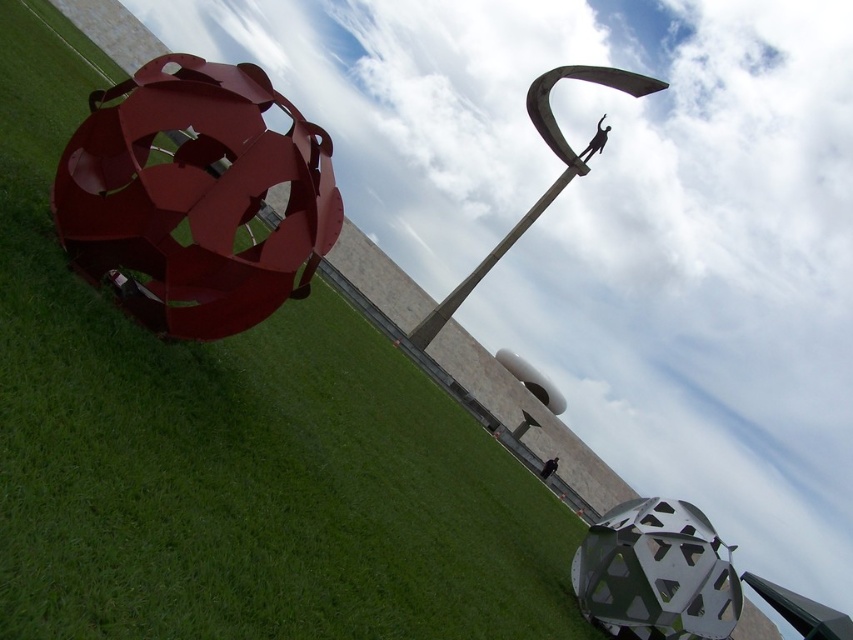
What are the coordinates of the rusty metal sphere at left?

The coordinates of the rusty metal sphere at left are 0.308 in the x axis and 0.230 in the y axis.

You are an art student analyzing the sculptures in the image. You notice the metallic sphere at center and the rusty metal sphere at left. Which sculpture would cast a larger shadow if the sun is directly overhead?

The metallic sphere at center is larger in size than the rusty metal sphere at left, so it would cast a larger shadow when the sun is directly overhead.

You are an art curator planning to install a new sculpture in the center of the outdoor area. You have a sculpture that is 2 meters wide. The existing sculptures are the metallic sphere at center and the polished metal sculpture at upper center. Based on their widths, can the new sculpture fit between them without overlapping?

The metallic sphere at center has a lesser width compared to the polished metal sculpture at upper center. Since the new sculpture is 2 meters wide, we need to know the exact widths of both existing sculptures to determine if there is enough space between them. However, the provided information only states that the metallic sphere is narrower than the polished metal sculpture. Without specific measurements, it is impossible to confirm if the 2 meter wide sculpture can fit between them.